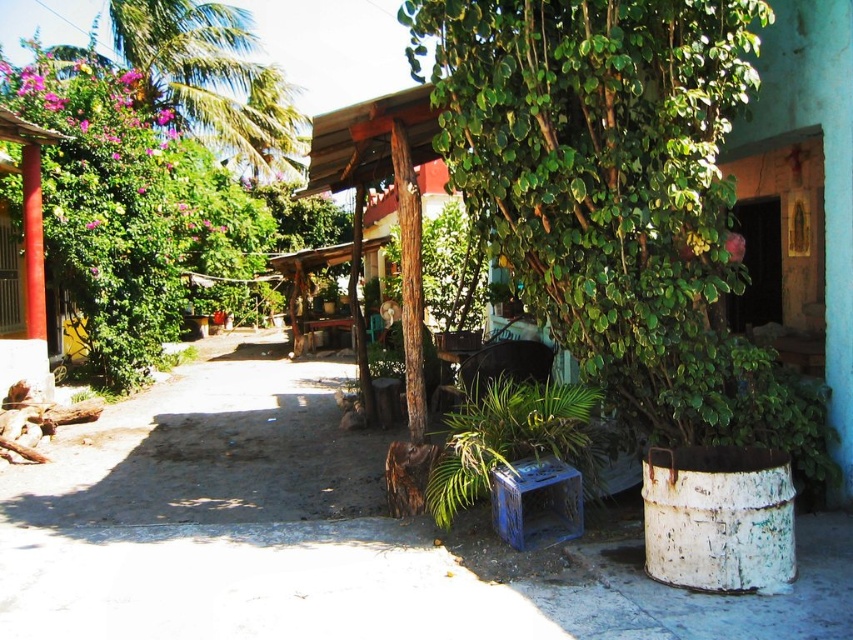
Question: Which of these objects is positioned farthest from the green leafy palm tree at upper left?

Choices:
 (A) smooth red column at left
 (B) rustic concrete alley at center

Answer: (B)

Question: Which point is farther to the camera?

Choices:
 (A) rustic concrete alley at center
 (B) smooth red column at left

Answer: (B)

Question: Does rustic concrete alley at center come in front of green leafy palm tree at upper left?

Choices:
 (A) no
 (B) yes

Answer: (B)

Question: Does green leafy palm tree at upper left have a larger size compared to smooth red column at left?

Choices:
 (A) yes
 (B) no

Answer: (A)

Question: In this image, where is rustic concrete alley at center located relative to green leafy palm tree at upper left?

Choices:
 (A) below
 (B) above

Answer: (A)

Question: Which object is farther from the camera taking this photo?

Choices:
 (A) smooth red column at left
 (B) rustic concrete alley at center

Answer: (A)